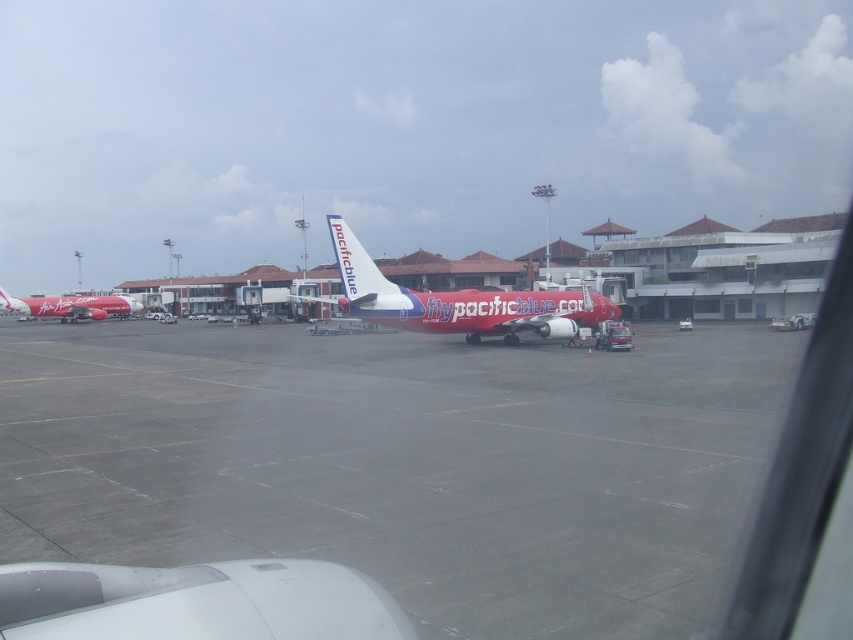
Who is positioned more to the right, gray asphalt runway at center or matte red airplane at center?

gray asphalt runway at center

Is gray asphalt runway at center below matte red airplane at center?

Indeed, gray asphalt runway at center is positioned under matte red airplane at center.

This screenshot has height=640, width=853. Identify the location of gray asphalt runway at center. (404, 464).

Where is `gray asphalt runway at center`? The height and width of the screenshot is (640, 853). gray asphalt runway at center is located at coordinates (404, 464).

Can you confirm if matte red airplane at center is positioned above matte red airplane at left?

Correct, matte red airplane at center is located above matte red airplane at left.

Can you confirm if matte red airplane at center is thinner than matte red airplane at left?

Incorrect, matte red airplane at center's width is not less than matte red airplane at left's.

This screenshot has width=853, height=640. What do you see at coordinates (457, 301) in the screenshot? I see `matte red airplane at center` at bounding box center [457, 301].

Where is `matte red airplane at center`? The width and height of the screenshot is (853, 640). matte red airplane at center is located at coordinates (457, 301).

Who is higher up, gray asphalt runway at center or matte red airplane at left?

matte red airplane at left is above.

Who is more forward, (393, 460) or (131, 304)?

Positioned in front is point (393, 460).

Identify the location of gray asphalt runway at center. This screenshot has width=853, height=640. (404, 464).